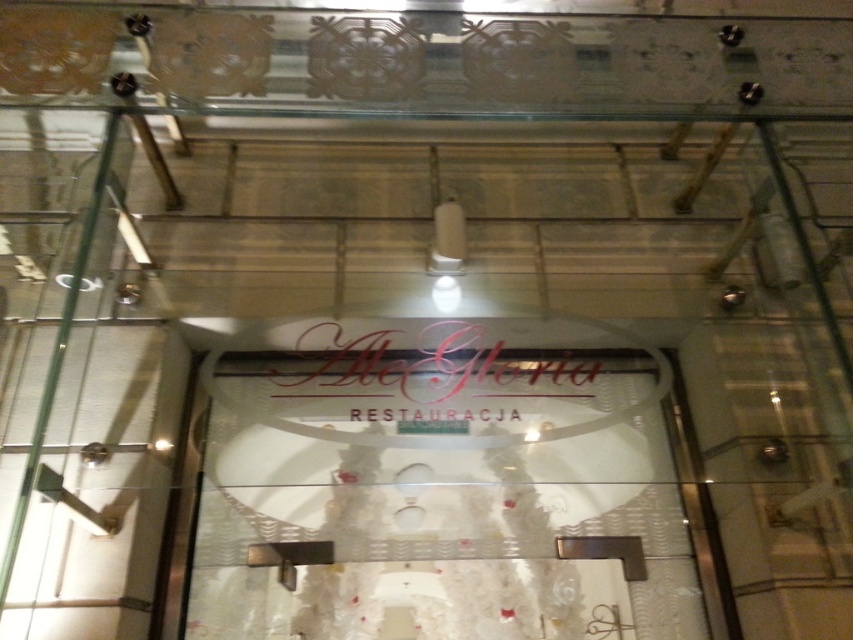
Find the location of `transparent glass signboard at center`. transparent glass signboard at center is located at coordinates (439, 484).

Which of these two, transparent glass signboard at center or matte gold sign at center, stands taller?

transparent glass signboard at center is taller.

Which is in front, point (544, 550) or point (450, 416)?

Point (544, 550)

The height and width of the screenshot is (640, 853). What are the coordinates of `transparent glass signboard at center` in the screenshot? It's located at (439, 484).